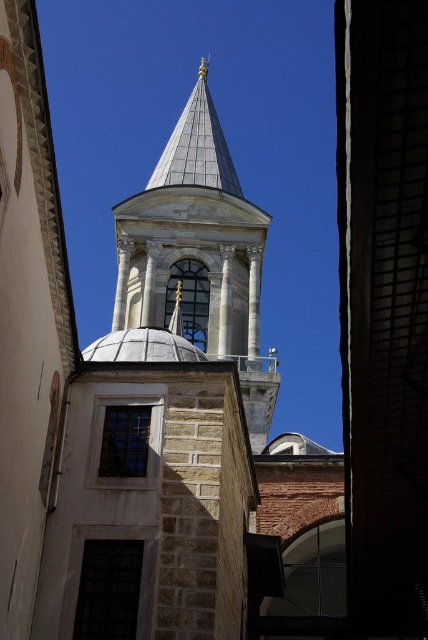
Is white stone tower at center positioned at the back of white marble dome at center?

Yes.

Is the position of white stone tower at center less distant than that of white marble dome at center?

No, it is not.

Does point (192, 246) come closer to viewer compared to point (122, 360)?

No, it is behind (122, 360).

The image size is (428, 640). In order to click on white stone tower at center in this screenshot , I will do `click(199, 253)`.